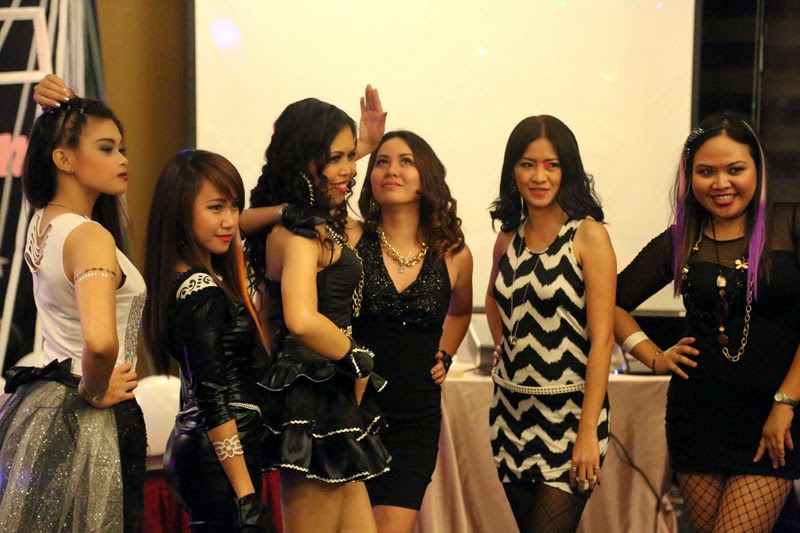
Where is `projection screen`? Image resolution: width=800 pixels, height=533 pixels. projection screen is located at coordinates (452, 59).